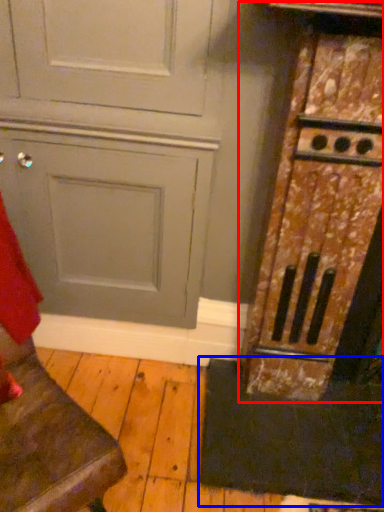
Question: Which object is further to the camera taking this photo, cabinetry (highlighted by a red box) or doormat (highlighted by a blue box)?

Choices:
 (A) cabinetry
 (B) doormat

Answer: (B)